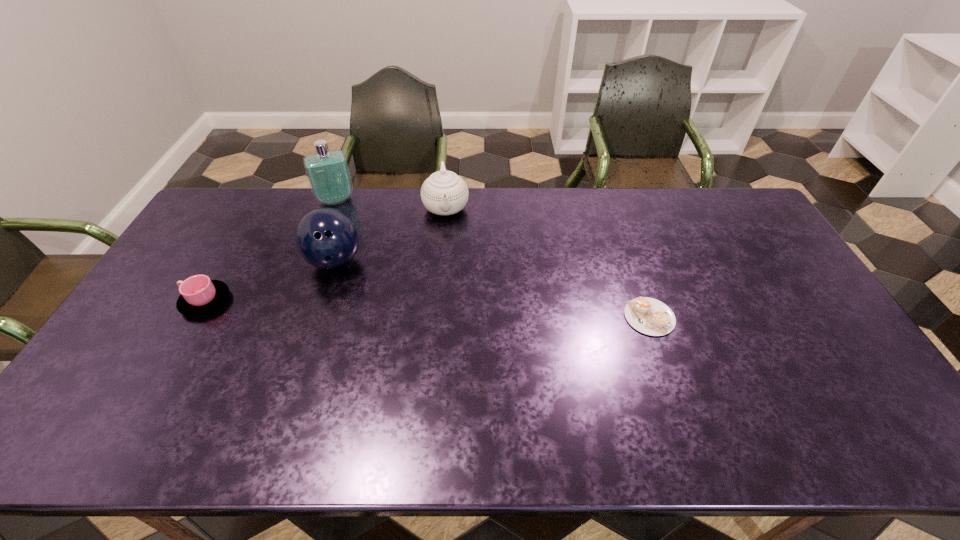
What are the coordinates of `the second shortest object` in the screenshot? It's located at (199, 295).

Where is `cup`? This screenshot has width=960, height=540. cup is located at coordinates (199, 295).

You are a GUI agent. You are given a task and a screenshot of the screen. Output one action in this format:
    pyautogui.click(x=<x>, y=<y>)
    Task: Click on the cappuccino
    Image resolution: width=960 pixels, height=540 pixels.
    Given the screenshot: What is the action you would take?
    pyautogui.click(x=649, y=316)

Where is `the shortest object`? Image resolution: width=960 pixels, height=540 pixels. the shortest object is located at coordinates (649, 316).

This screenshot has width=960, height=540. What are the coordinates of `bowling ball` in the screenshot? It's located at (326, 238).

You are a GUI agent. You are given a task and a screenshot of the screen. Output one action in this format:
    pyautogui.click(x=<x>, y=<y>)
    Task: Click on the tallest object
    
    Given the screenshot: What is the action you would take?
    pyautogui.click(x=328, y=174)

I want to click on chinaware, so click(x=443, y=193).

The width and height of the screenshot is (960, 540). I want to click on free spot located on the side with the handle of the fourth tallest object, so click(x=161, y=301).

Find the location of `free space located 0.330m on the right of the shortest object`. free space located 0.330m on the right of the shortest object is located at coordinates (790, 317).

Locate an element on the screen. This screenshot has width=960, height=540. free region located on the surface of the third nearest object near the finger holes is located at coordinates (396, 359).